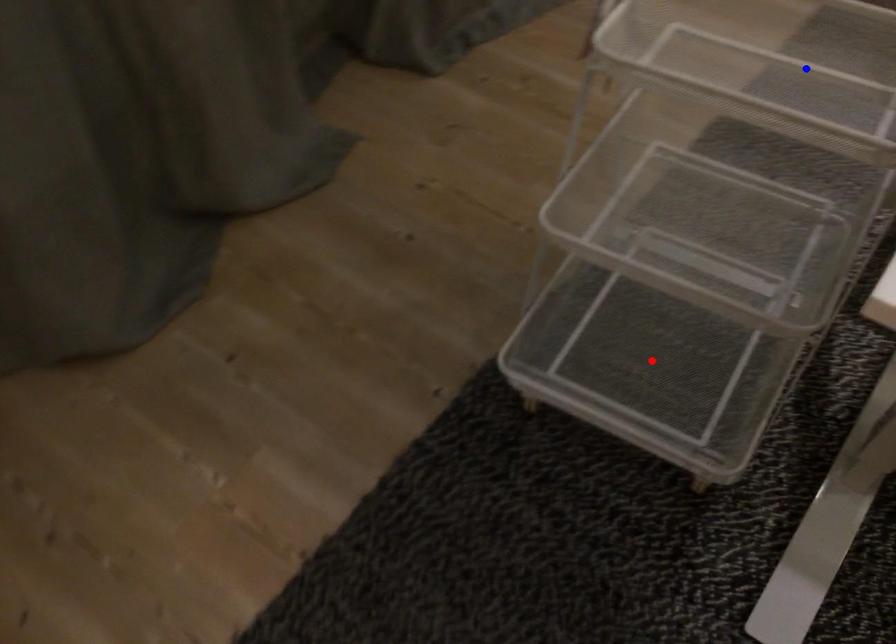
Question: In the image, two points are highlighted. Which point is nearer to the camera? Reply with the corresponding letter.

Choices:
 (A) blue point
 (B) red point

Answer: (A)